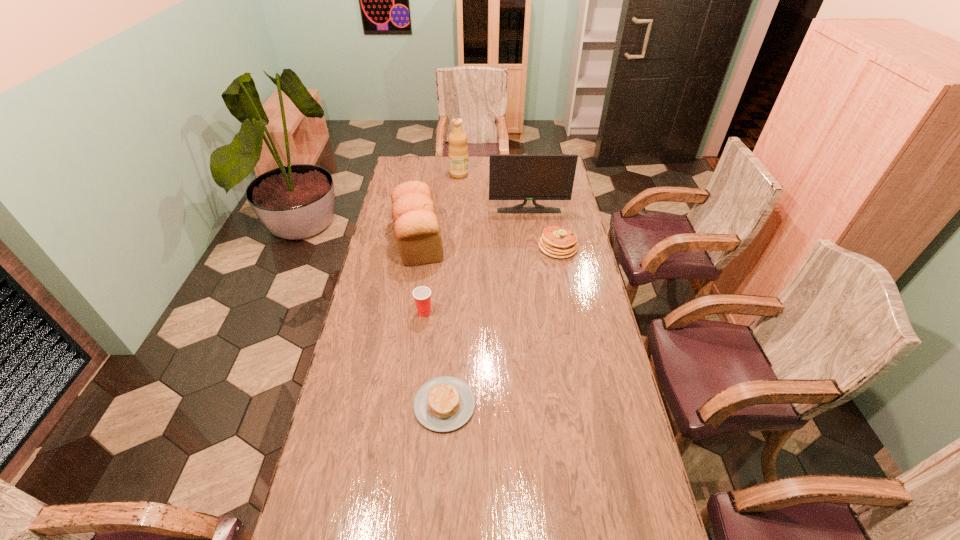
You are a GUI agent. You are given a task and a screenshot of the screen. Output one action in this format:
    pyautogui.click(x=<x>, y=<y>)
    Task: Click on the olive oil
    The image size is (960, 540).
    Given the screenshot: What is the action you would take?
    pyautogui.click(x=458, y=150)

I want to click on monitor, so click(x=525, y=177).

Find the location of a particular element. The height and width of the screenshot is (540, 960). the fourth shortest object is located at coordinates (416, 227).

Identify the location of the fifth farthest object. (422, 295).

Identify the location of Dixie cup. (422, 295).

Identify the location of the second shortest object. (557, 242).

At what (x,y) coordinates should I click in order to perform the action: click on the farther pancake. Please return your answer as a coordinate pair (x, y). Image resolution: width=960 pixels, height=540 pixels. Looking at the image, I should click on (557, 242).

Identify the location of the shortest object. (443, 404).

I want to click on the shorter pancake, so click(x=443, y=404).

You are a GUI agent. You are given a task and a screenshot of the screen. Output one action in this format:
    pyautogui.click(x=<x>, y=<y>)
    Task: Click on the free space located 0.080m on the label of the olive oil
    The width and height of the screenshot is (960, 540).
    Given the screenshot: What is the action you would take?
    pyautogui.click(x=484, y=174)